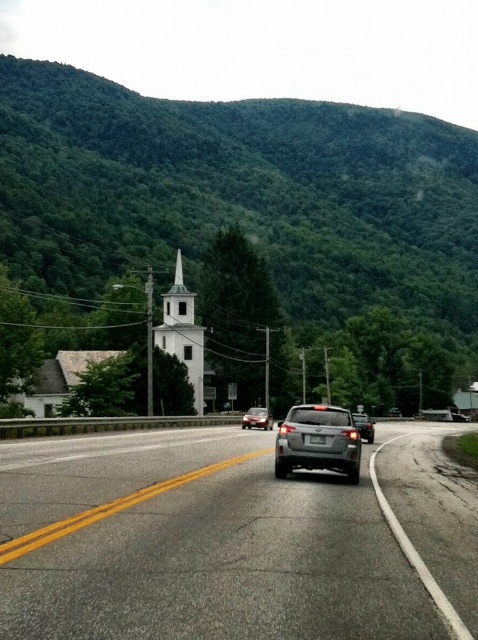
Who is more distant from viewer, (296, 436) or (354, 420)?

Positioned behind is point (354, 420).

Between satin gray suv at center and glossy black car at center, which one has less height?

Standing shorter between the two is satin gray suv at center.

Does point (335, 419) come farther from viewer compared to point (365, 432)?

No, it is not.

What are the coordinates of `satin gray suv at center` in the screenshot? It's located at (317, 442).

Can you confirm if satin gray suv at center is wider than white smooth steeple at center?

In fact, satin gray suv at center might be narrower than white smooth steeple at center.

Where is `satin gray suv at center`? The width and height of the screenshot is (478, 640). satin gray suv at center is located at coordinates (317, 442).

Who is more forward, (130, 145) or (365, 422)?

Positioned in front is point (365, 422).

Is green leafy mountain at upper center positioned behind glossy black car at center?

Yes, it is.

Between point (422, 221) and point (356, 426), which one is positioned behind?

Positioned behind is point (422, 221).

You are a GUI agent. You are given a task and a screenshot of the screen. Output one action in this format:
    pyautogui.click(x=<x>, y=<y>)
    Task: Click on the green leafy mountain at upper center
    This screenshot has height=640, width=478.
    Given the screenshot: What is the action you would take?
    pyautogui.click(x=239, y=195)